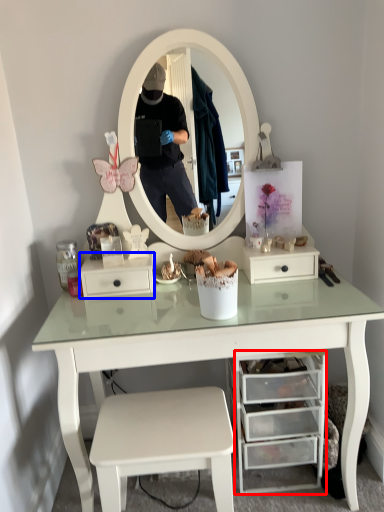
Question: Which of the following is the closest to the observer, drawer (highlighted by a red box) or drawer (highlighted by a blue box)?

Choices:
 (A) drawer
 (B) drawer

Answer: (A)